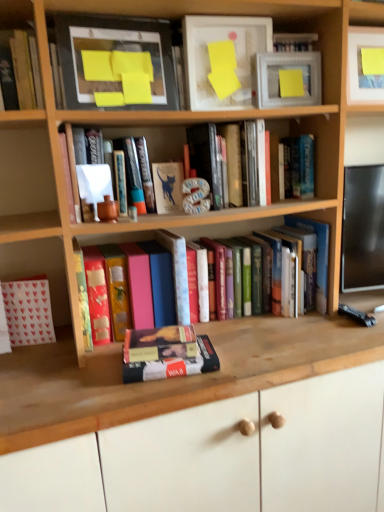
Where is `blank space situated above wooden at lower center (from a real-world perspective)`? blank space situated above wooden at lower center (from a real-world perspective) is located at coordinates (213, 332).